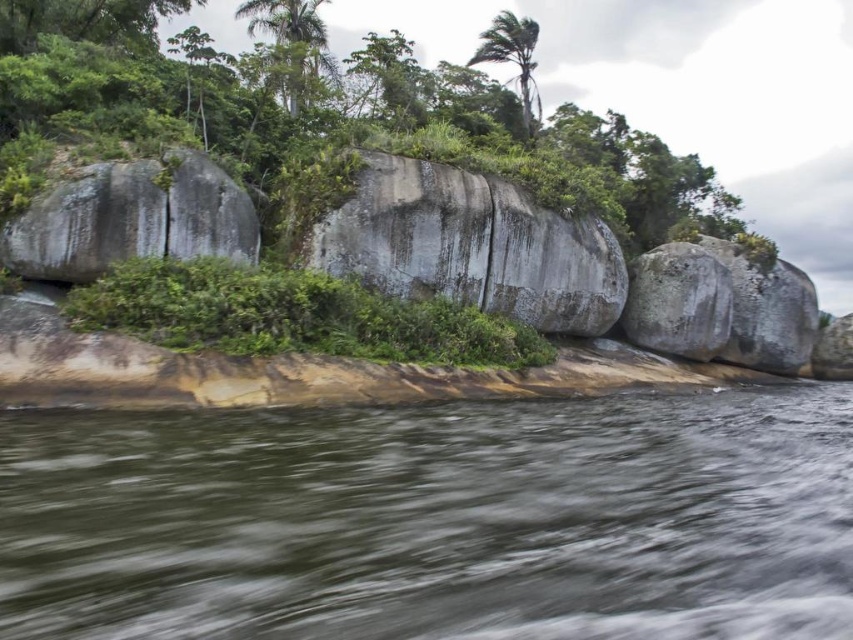
Does green leafy shrubs at center have a greater width compared to green leafy tree at upper left?

Incorrect, green leafy shrubs at center's width does not surpass green leafy tree at upper left's.

What do you see at coordinates (292, 314) in the screenshot? This screenshot has width=853, height=640. I see `green leafy shrubs at center` at bounding box center [292, 314].

Locate an element on the screen. The width and height of the screenshot is (853, 640). green leafy shrubs at center is located at coordinates (292, 314).

Does gray textured rock at center appear on the right side of green leafy palm tree at upper center?

No, gray textured rock at center is not to the right of green leafy palm tree at upper center.

Who is more distant from viewer, (595, 285) or (489, 26)?

The point (489, 26) is behind.

Which is behind, point (567, 246) or point (490, 33)?

The point (490, 33) is behind.

Locate an element on the screen. This screenshot has height=640, width=853. gray textured rock at center is located at coordinates pyautogui.click(x=473, y=244).

Can you confirm if green leafy tree at center is smaller than green leafy shrubs at center?

Actually, green leafy tree at center might be larger than green leafy shrubs at center.

This screenshot has height=640, width=853. I want to click on green leafy tree at center, so [323, 120].

Between point (320, 3) and point (498, 321), which one is positioned in front?

Point (498, 321)

Identify the location of green leafy tree at center. The width and height of the screenshot is (853, 640). (323, 120).